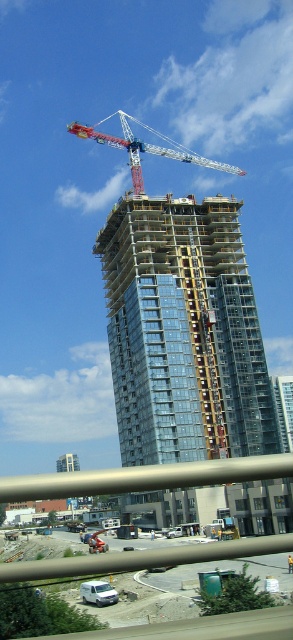
You are a construction worker standing at the base of the building and want to reach the red painted metal crane at upper center. The safety regulations state that you must stay within 120 meters of the crane at all times. Can you safely proceed to the crane?

The red painted metal crane at upper center is 119.13 meters away from camera, so yes, you can safely proceed to the crane as the distance is within the 120 meters safety regulation requirement.

You are standing at point A and want to reach the glassy steel building at center. Which direction should you move to reach it?

Since the glassy steel building at center is located at point (x=184, y=332), you should move towards the center of the image to reach it.